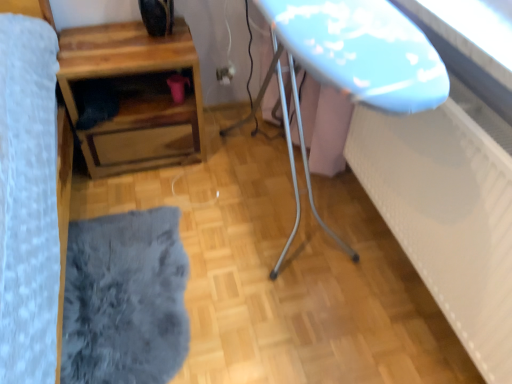
I want to click on vacant space to the right of wooden table at lower left, so click(229, 159).